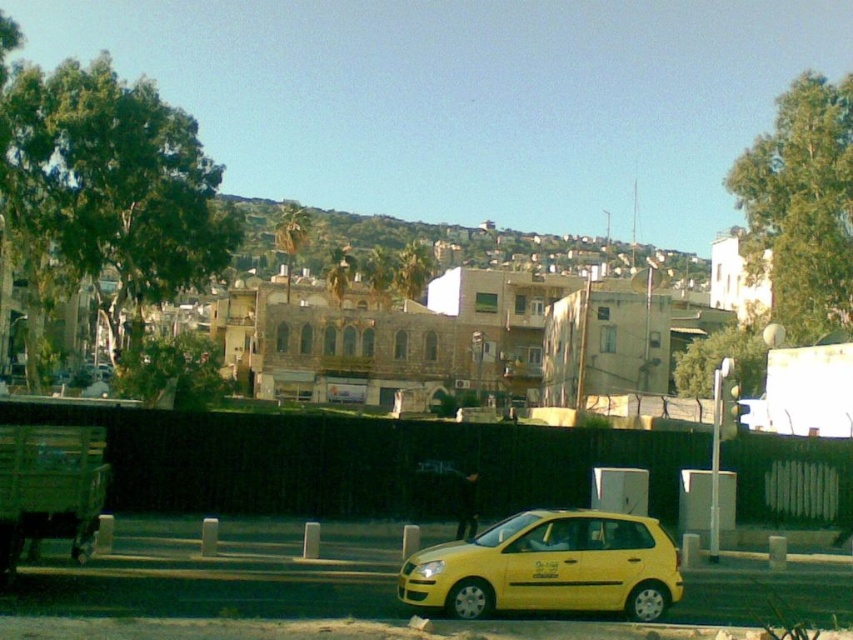
Does yellow matte car at lower center appear over green grassy hillside at upper center?

Actually, yellow matte car at lower center is below green grassy hillside at upper center.

Who is shorter, yellow matte car at lower center or green grassy hillside at upper center?

yellow matte car at lower center

Is point (515, 538) less distant than point (386, 216)?

Yes.

Where is `yellow matte car at lower center`? yellow matte car at lower center is located at coordinates (549, 566).